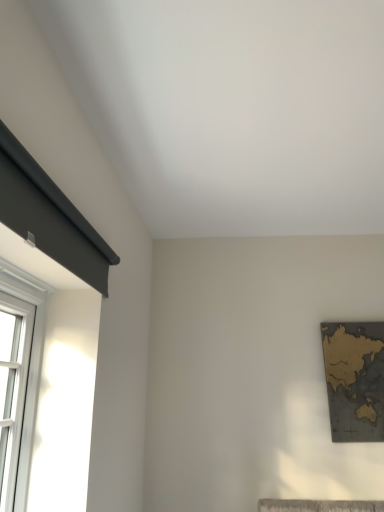
Question: Should I look upward or downward to see gold metallic map at right?

Choices:
 (A) up
 (B) down

Answer: (B)